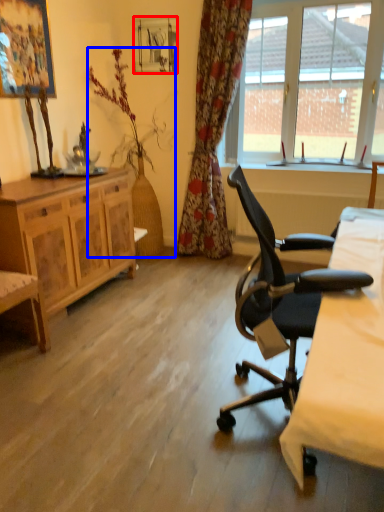
Question: Which point is closer to the camera, picture frame (highlighted by a red box) or houseplant (highlighted by a blue box)?

Choices:
 (A) picture frame
 (B) houseplant

Answer: (B)